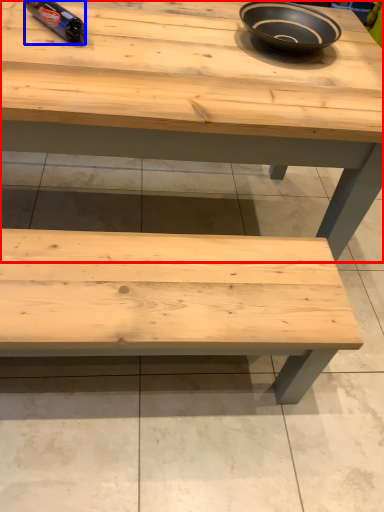
Question: Which object is closer to the camera taking this photo, table (highlighted by a red box) or bottle (highlighted by a blue box)?

Choices:
 (A) table
 (B) bottle

Answer: (A)